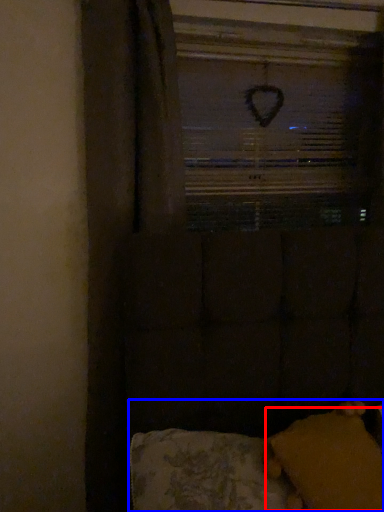
Question: Which object appears farthest to the camera in this image, pillow (highlighted by a red box) or furniture (highlighted by a blue box)?

Choices:
 (A) pillow
 (B) furniture

Answer: (A)